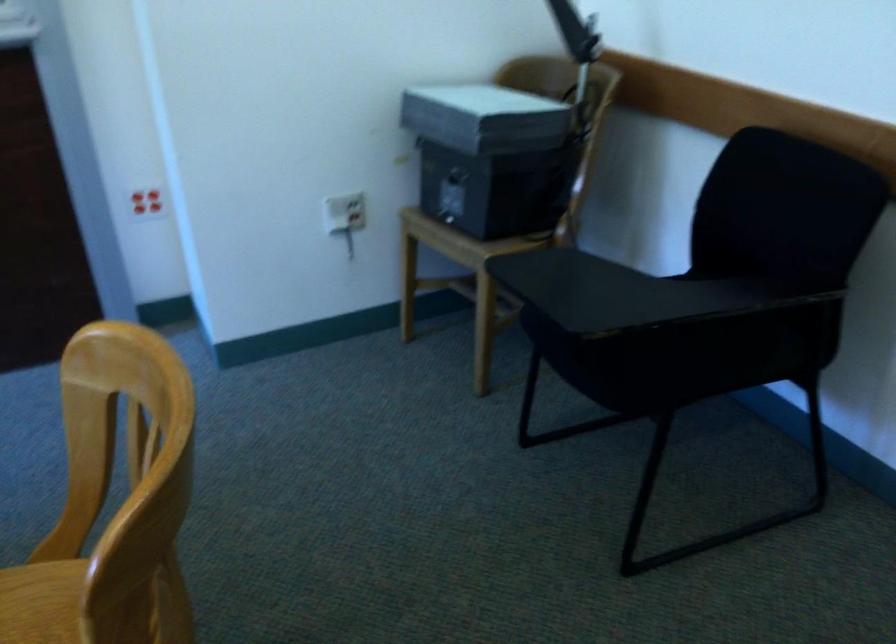
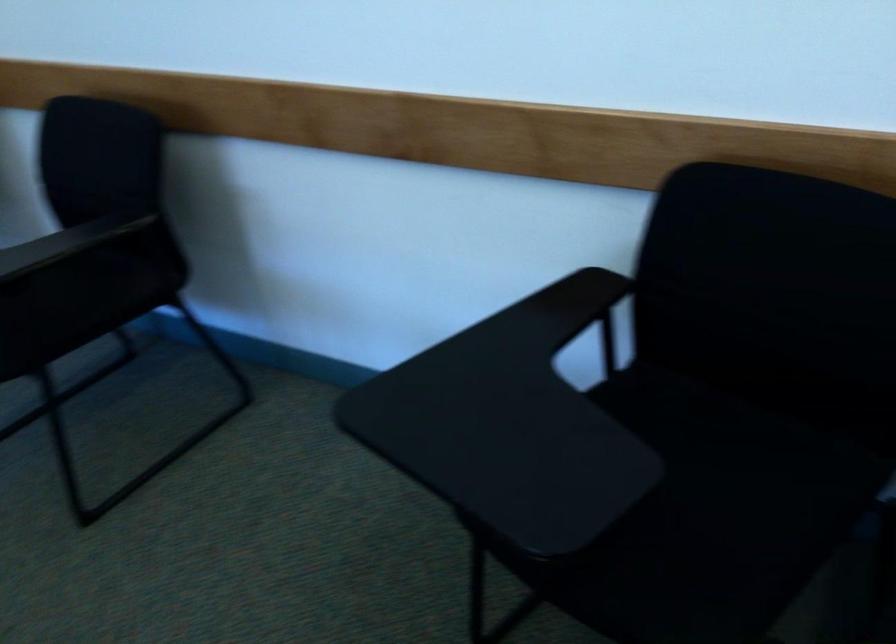
Question: The camera is either moving clockwise (left) or counter-clockwise (right) around the object. The first image is from the beginning of the video and the second image is from the end. Is the camera moving left or right when shooting the video?

Choices:
 (A) Left
 (B) Right

Answer: (A)